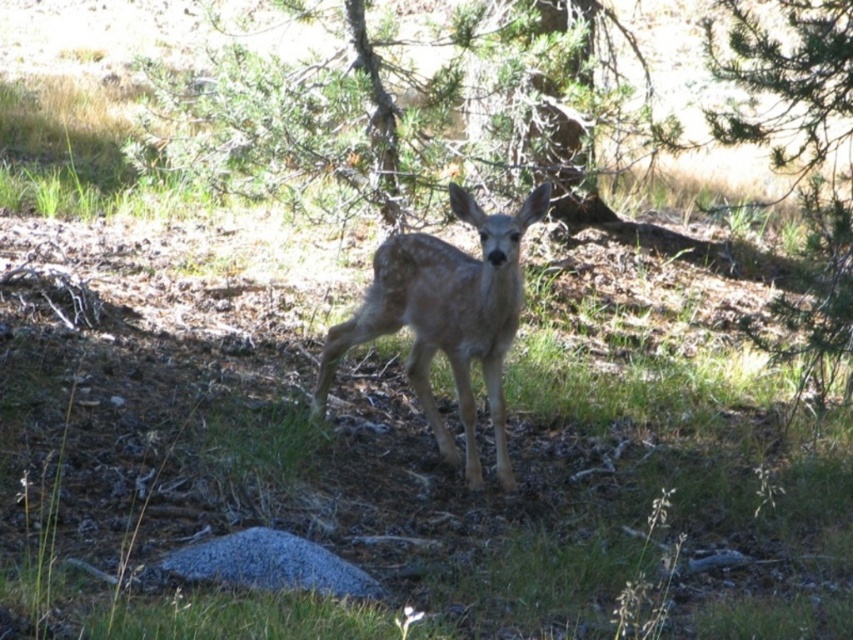
Is green textured tree at upper center to the left of fawn fur at center from the viewer's perspective?

Yes, green textured tree at upper center is to the left of fawn fur at center.

Which is in front, point (317, 17) or point (424, 292)?

Positioned in front is point (424, 292).

Locate an element on the screen. green textured tree at upper center is located at coordinates (405, 112).